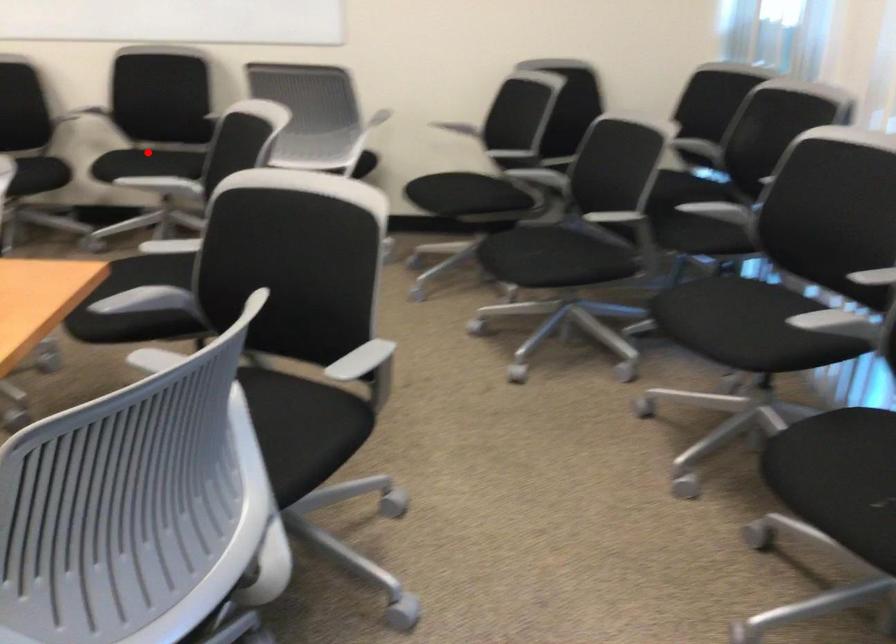
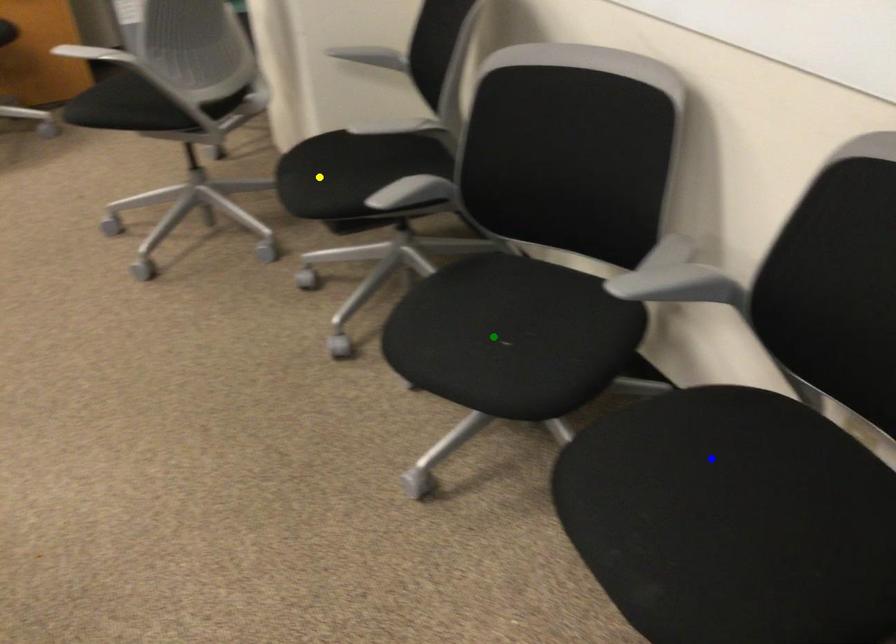
Question: I am providing you with two images of the same scene from different viewpoints. A red point is marked on the first image. You are given multiple points on the second image. Which point in image 2 represents the same 3d spot as the red point in image 1?

Choices:
 (A) green point
 (B) blue point
 (C) yellow point

Answer: (B)